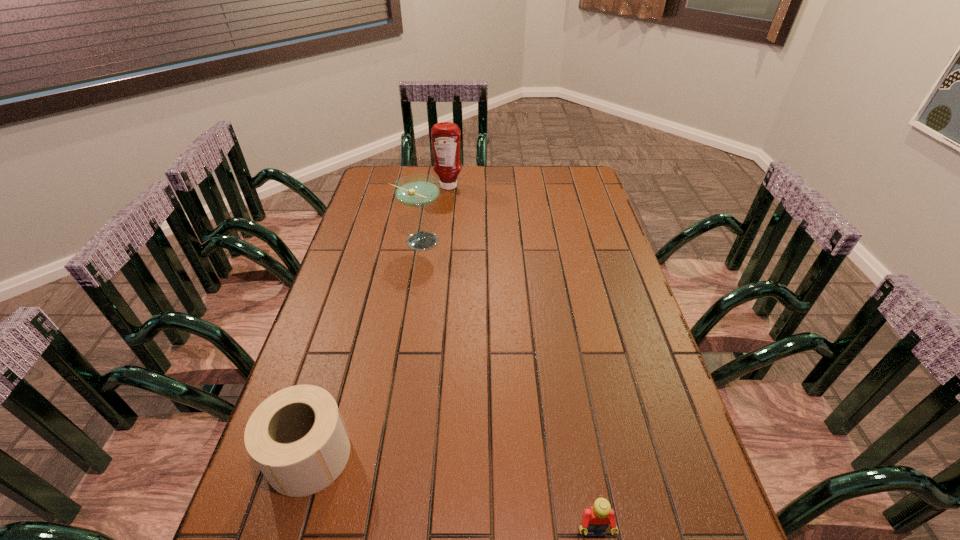
At what (x,y) coordinates should I click in order to perform the action: click on the farthest object. Please return your answer as a coordinate pair (x, y). This screenshot has width=960, height=540. Looking at the image, I should click on (445, 136).

Locate an element on the screen. This screenshot has width=960, height=540. the third nearest object is located at coordinates (415, 190).

I want to click on toilet tissue, so click(x=297, y=438).

Where is `the second shortest object`? The height and width of the screenshot is (540, 960). the second shortest object is located at coordinates (297, 438).

Where is `vacant space located 0.380m on the front of the farthest object`? This screenshot has width=960, height=540. vacant space located 0.380m on the front of the farthest object is located at coordinates (442, 251).

Find the location of a particular element. This screenshot has width=960, height=540. vacant region located on the right of the martini is located at coordinates (532, 241).

You are a GUI agent. You are given a task and a screenshot of the screen. Output one action in this format:
    pyautogui.click(x=<x>, y=<y>)
    Task: Click on the vacant position located on the right of the third tallest object
    Image resolution: width=960 pixels, height=540 pixels.
    Given the screenshot: What is the action you would take?
    pyautogui.click(x=503, y=455)

In order to click on object positioned at the far edge in this screenshot , I will do `click(445, 136)`.

At what (x,y) coordinates should I click in order to perform the action: click on object at the left edge. Please return your answer as a coordinate pair (x, y). Looking at the image, I should click on (297, 438).

This screenshot has width=960, height=540. Find the location of `vacant space at the far edge of the desktop`. vacant space at the far edge of the desktop is located at coordinates (491, 166).